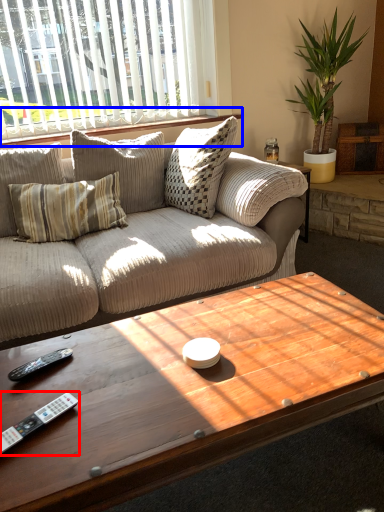
Question: Which object appears closest to the camera in this image, control (highlighted by a red box) or window sill (highlighted by a blue box)?

Choices:
 (A) control
 (B) window sill

Answer: (A)